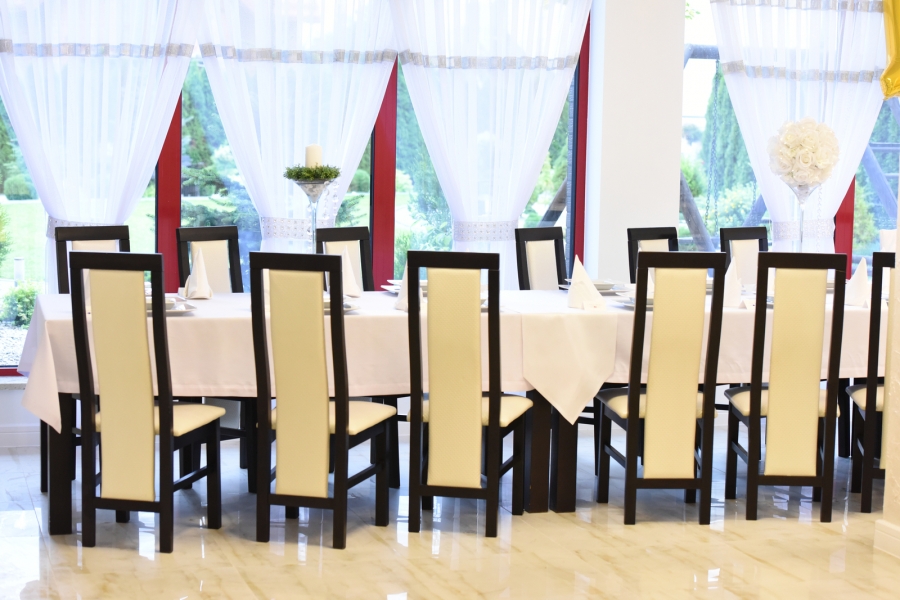
Identify the location of chairs on the near side of the table. This screenshot has width=900, height=600. (121, 459), (310, 461), (466, 442), (704, 421), (804, 420), (884, 427).